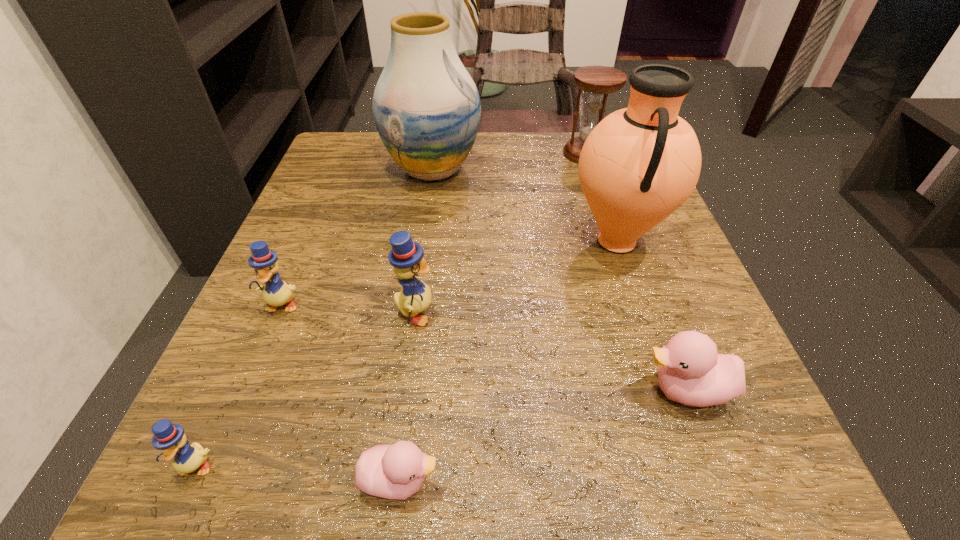
At what (x,y) coordinates should I click in order to perform the action: click on vase. Please return your answer as a coordinate pair (x, y). The width and height of the screenshot is (960, 540). Looking at the image, I should click on (426, 107).

At what (x,y) coordinates should I click in order to perform the action: click on the sixth nearest object. Please return your answer as a coordinate pair (x, y). Looking at the image, I should click on click(639, 164).

Find the location of a particular element. The image size is (960, 540). hourglass is located at coordinates (598, 81).

The height and width of the screenshot is (540, 960). In order to click on the rightmost yellow duckling in this screenshot , I will do `click(406, 256)`.

Find the location of a particular element. the biggest yellow duckling is located at coordinates click(x=406, y=256).

In order to click on the second smallest yellow duckling in this screenshot , I will do `click(276, 292)`.

This screenshot has width=960, height=540. Identify the location of the sixth farthest object. (691, 371).

This screenshot has width=960, height=540. I want to click on the rightmost duckling, so click(691, 371).

Where is `the smallest yellow duckling`? This screenshot has height=540, width=960. the smallest yellow duckling is located at coordinates pyautogui.click(x=170, y=438).

The image size is (960, 540). Find the location of `the shortest object`. the shortest object is located at coordinates (396, 471).